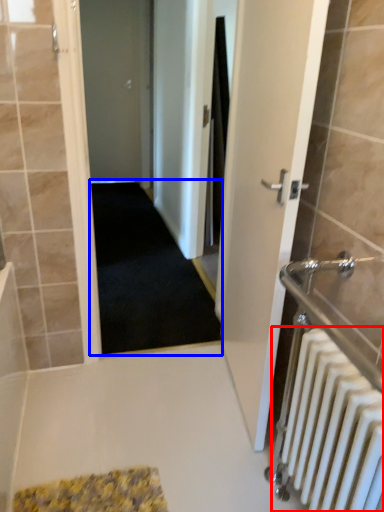
Question: Which object appears farthest to the camera in this image, radiator (highlighted by a red box) or doormat (highlighted by a blue box)?

Choices:
 (A) radiator
 (B) doormat

Answer: (B)